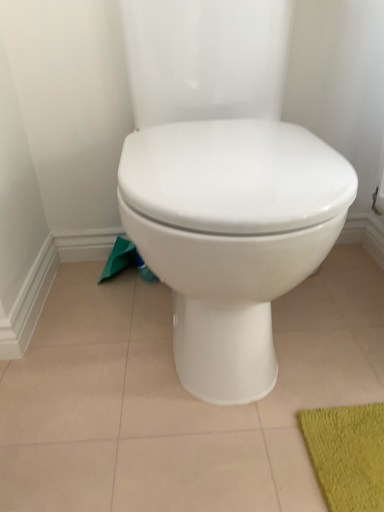
Question: Is green fabric toilet paper at lower left shorter than white glossy toilet at center?

Choices:
 (A) no
 (B) yes

Answer: (B)

Question: Is green fabric toilet paper at lower left bigger than white glossy toilet at center?

Choices:
 (A) yes
 (B) no

Answer: (B)

Question: Is green fabric toilet paper at lower left to the left of white glossy toilet at center from the viewer's perspective?

Choices:
 (A) yes
 (B) no

Answer: (A)

Question: From the image's perspective, is green fabric toilet paper at lower left beneath white glossy toilet at center?

Choices:
 (A) no
 (B) yes

Answer: (B)

Question: From the image's perspective, is green fabric toilet paper at lower left on top of white glossy toilet at center?

Choices:
 (A) no
 (B) yes

Answer: (A)

Question: Considering the relative sizes of green fabric toilet paper at lower left and white glossy toilet at center in the image provided, is green fabric toilet paper at lower left taller than white glossy toilet at center?

Choices:
 (A) no
 (B) yes

Answer: (A)

Question: From a real-world perspective, is white glossy toilet at center located higher than green fabric toilet paper at lower left?

Choices:
 (A) no
 (B) yes

Answer: (B)

Question: Is the depth of white glossy toilet at center less than that of green fabric toilet paper at lower left?

Choices:
 (A) yes
 (B) no

Answer: (A)

Question: Can you confirm if white glossy toilet at center is wider than green fabric toilet paper at lower left?

Choices:
 (A) no
 (B) yes

Answer: (B)

Question: Does white glossy toilet at center appear on the left side of green fabric toilet paper at lower left?

Choices:
 (A) no
 (B) yes

Answer: (A)

Question: Is green fabric toilet paper at lower left located within white glossy toilet at center?

Choices:
 (A) no
 (B) yes

Answer: (A)

Question: Is white glossy toilet at center far from green fabric toilet paper at lower left?

Choices:
 (A) no
 (B) yes

Answer: (A)

Question: Is point (122, 258) positioned closer to the camera than point (274, 373)?

Choices:
 (A) farther
 (B) closer

Answer: (A)